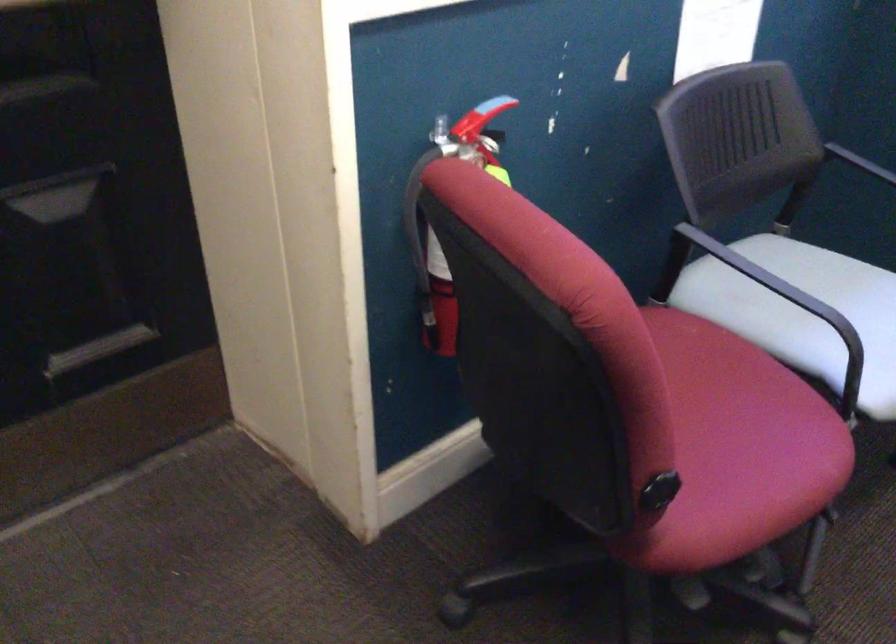
Find where to sit the white chair sitting surface. Please return your answer as a coordinate pair (x, y).

(842, 276)